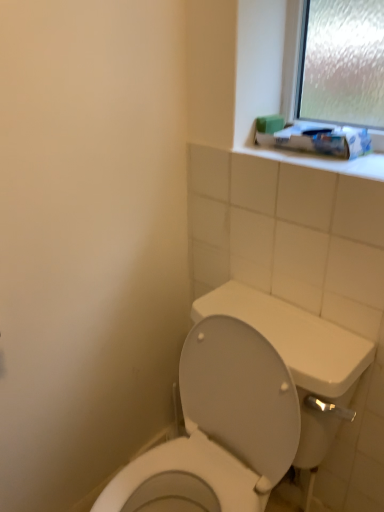
I want to click on white matte toilet paper at upper right, so click(313, 137).

This screenshot has height=512, width=384. Describe the element at coordinates (313, 137) in the screenshot. I see `white matte toilet paper at upper right` at that location.

You are a GUI agent. You are given a task and a screenshot of the screen. Output one action in this format:
    pyautogui.click(x=<x>, y=<y>)
    Task: Click on the white matte toilet paper at upper right
    Image resolution: width=384 pixels, height=512 pixels.
    Given the screenshot: What is the action you would take?
    pyautogui.click(x=313, y=137)